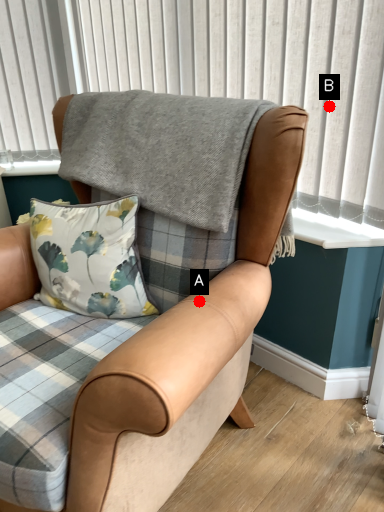
Question: Two points are circled on the image, labeled by A and B beside each circle. Which point is farther to the camera?

Choices:
 (A) A is further
 (B) B is further

Answer: (B)